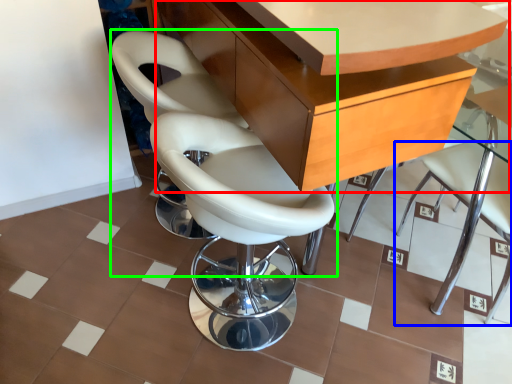
Question: Considering the real-world distances, which object is closest to table (highlighted by a red box)? chair (highlighted by a blue box) or chair (highlighted by a green box).

Choices:
 (A) chair
 (B) chair

Answer: (B)